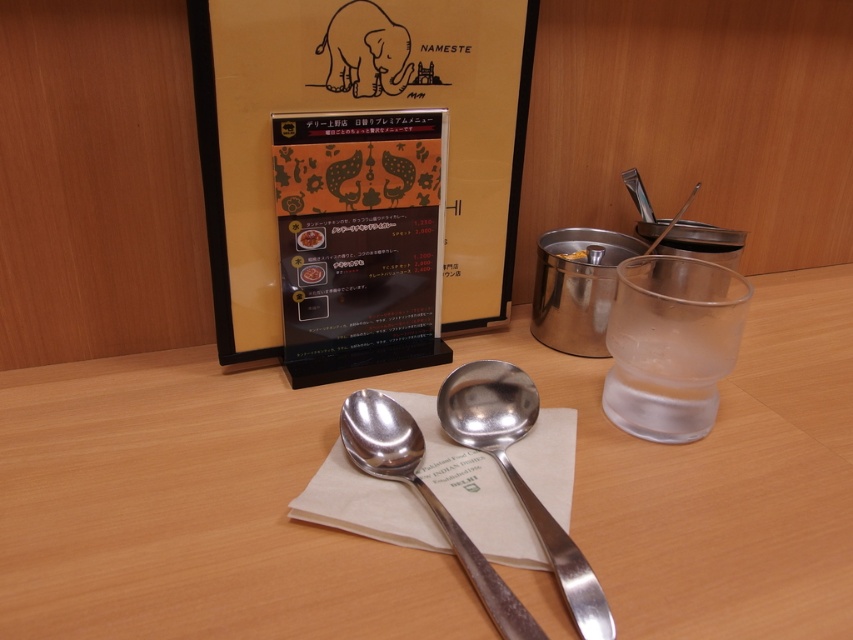
You are a waiter at this restaurant and need to place a new menu on the table. The menu must be placed exactly at the point with coordinates (410, 548). However, you notice that this point is already occupied by an object. Which object is located at this coordinate?

The point at coordinates (410, 548) is occupied by the satin silver spoons at center.

You are a customer at the restaurant and want to read the menu. The black plastic menu at center is placed between you and the matte brown elephant at upper center. Can you easily access the menu without moving the elephant?

The black plastic menu at center is larger in size than the matte brown elephant at upper center. Since the menu is between you and the elephant, you can easily access the menu without needing to move the elephant because the menu is bigger and likely covers the area where the elephant is placed.